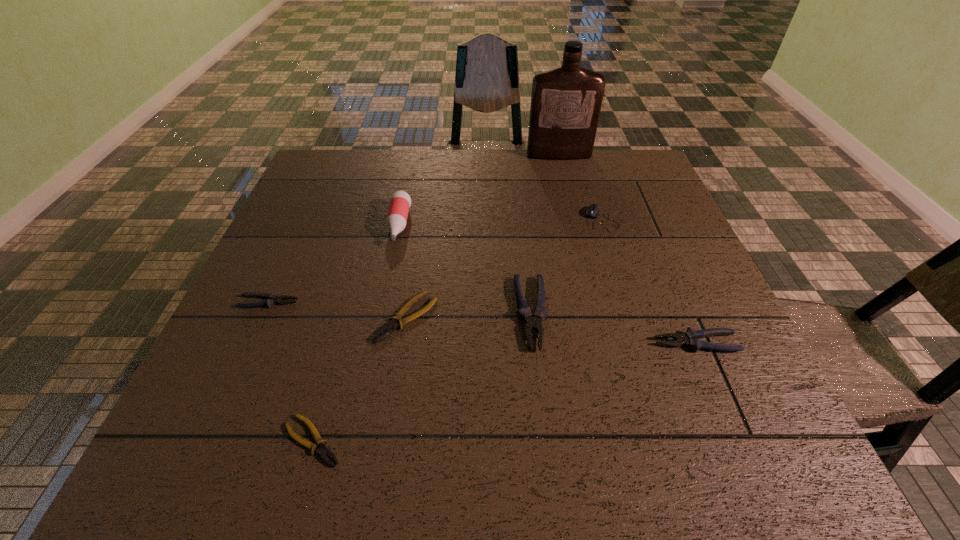
At what (x,y) coordinates should I click in order to perform the action: click on free space at the near edge. Please return your answer as a coordinate pair (x, y). Looking at the image, I should click on (555, 441).

Identify the location of vacant area at the left edge of the desktop. This screenshot has width=960, height=540. click(x=247, y=393).

Image resolution: width=960 pixels, height=540 pixels. What are the coordinates of `free space at the right edge` in the screenshot? It's located at (666, 230).

Identify the location of blank area at the far right corner. (615, 152).

At what (x,y) coordinates should I click in order to perform the action: click on free space at the near right corner. Please return your answer as a coordinate pair (x, y). The height and width of the screenshot is (540, 960). Looking at the image, I should click on (719, 431).

At what (x,y) coordinates should I click in order to perform the action: click on vacant space that's between the computer mouse and the farther yellow pliers. Please return your answer as a coordinate pair (x, y). Looking at the image, I should click on (504, 268).

This screenshot has height=540, width=960. What are the coordinates of `free area in between the second gray pliers from left to right and the tallest object` in the screenshot? It's located at (545, 234).

Where is `free space that is in between the tallest object and the computer mouse`? The width and height of the screenshot is (960, 540). free space that is in between the tallest object and the computer mouse is located at coordinates (580, 187).

Find the location of `vacant area that lies between the farthest object and the computer mouse`. vacant area that lies between the farthest object and the computer mouse is located at coordinates (580, 187).

Locate an element on the screen. This screenshot has width=960, height=540. vacant area that lies between the third pliers from left to right and the second biggest gray pliers is located at coordinates (551, 330).